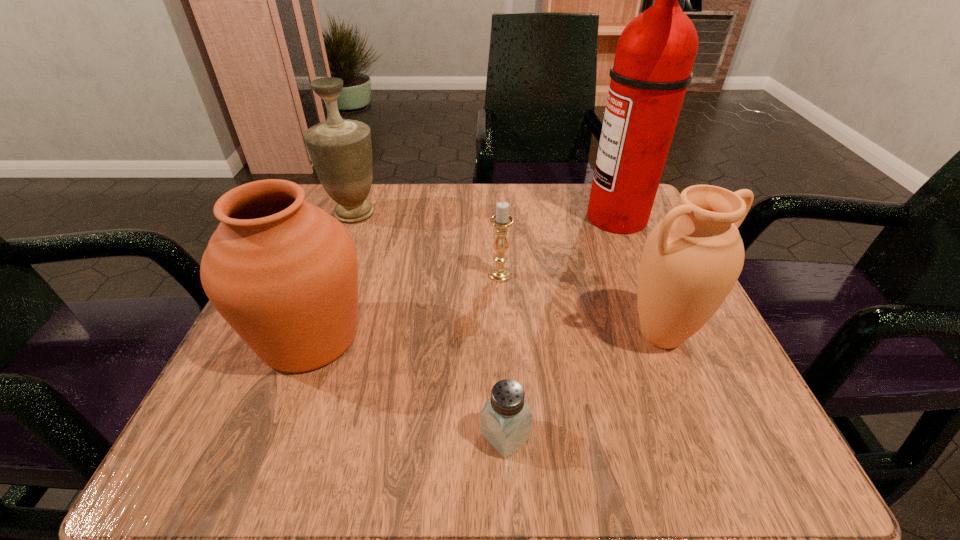
This screenshot has height=540, width=960. Find the location of `free location located 0.220m on the right of the farthest urn`. free location located 0.220m on the right of the farthest urn is located at coordinates (485, 213).

I want to click on free point located on the left of the rightmost urn, so click(454, 335).

I want to click on vacant space located 0.070m on the back of the third farthest object, so click(x=498, y=245).

You are a GUI agent. You are given a task and a screenshot of the screen. Output one action in this format:
    pyautogui.click(x=<x>, y=<y>)
    Task: Click on the vacant region located 0.320m on the left of the shortest object
    
    Given the screenshot: What is the action you would take?
    click(230, 436)

The width and height of the screenshot is (960, 540). Identify the location of fire extinguisher at the far edge. (655, 54).

The image size is (960, 540). What are the coordinates of `urn that is at the far edge` in the screenshot? It's located at (340, 149).

Locate an element on the screen. object that is at the near edge is located at coordinates (505, 421).

I want to click on fire extinguisher that is at the right edge, so coord(655,54).

You are a GUI agent. You are given a task and a screenshot of the screen. Output one action in this format:
    pyautogui.click(x=<x>, y=<y>)
    Task: Click on the urn present at the right edge
    
    Given the screenshot: What is the action you would take?
    pyautogui.click(x=691, y=260)

This screenshot has width=960, height=540. Identify the location of object located in the far left corner section of the desktop. (340, 149).